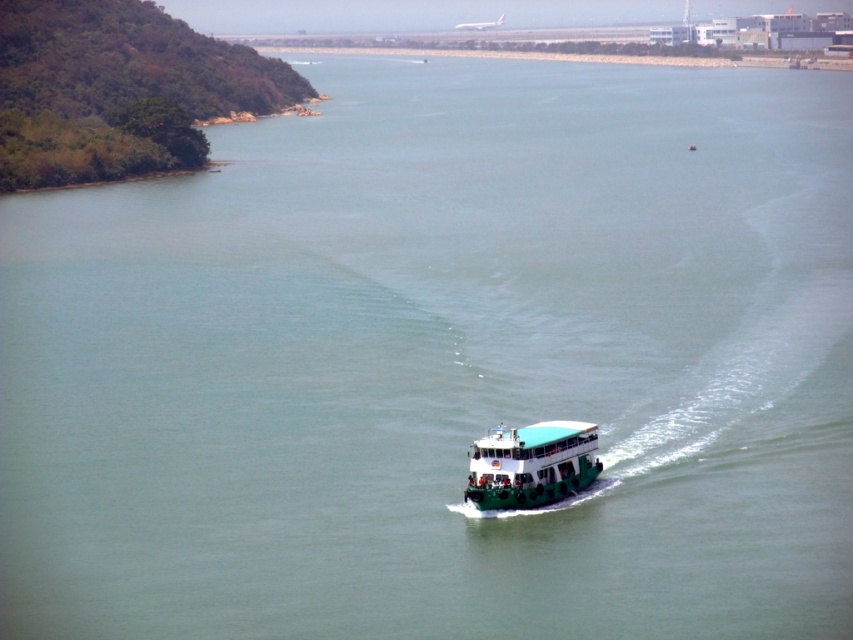
Does green matte ferry at center have a smaller size compared to concrete wall at upper center?

Correct, green matte ferry at center occupies less space than concrete wall at upper center.

Describe the element at coordinates (531, 465) in the screenshot. I see `green matte ferry at center` at that location.

Is point (581, 467) positioned before point (642, 60)?

That is True.

Locate an element on the screen. green matte ferry at center is located at coordinates (531, 465).